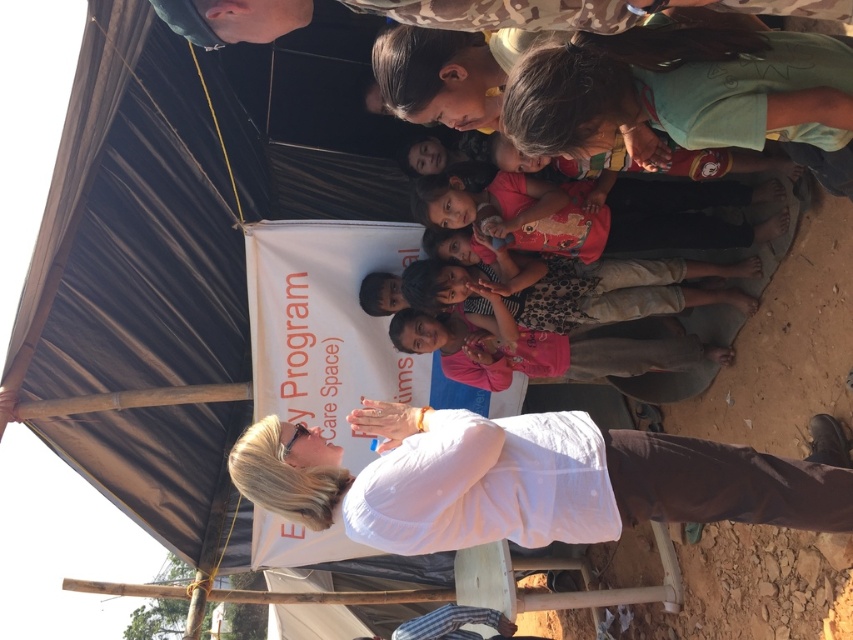
Does matte pink shirt at center appear on the left side of light brown skin at center?

Incorrect, matte pink shirt at center is not on the left side of light brown skin at center.

Which of these two, matte pink shirt at center or light brown skin at center, stands taller?

Standing taller between the two is matte pink shirt at center.

The image size is (853, 640). Describe the element at coordinates (645, 218) in the screenshot. I see `matte pink shirt at center` at that location.

At what (x,y) coordinates should I click in order to perform the action: click on matte pink shirt at center. Please return your answer as a coordinate pair (x, y). Looking at the image, I should click on (645, 218).

This screenshot has height=640, width=853. I want to click on matte pink shirt at center, so tap(645, 218).

Between point (477, 195) and point (425, 17), which one is positioned in front?

Point (425, 17)

Locate an element on the screen. The image size is (853, 640). matte pink shirt at center is located at coordinates (645, 218).

Can you confirm if light brown cotton pants at center is wider than camouflage fabric at upper center?

Yes, light brown cotton pants at center is wider than camouflage fabric at upper center.

Can you confirm if light brown cotton pants at center is taller than camouflage fabric at upper center?

Yes, light brown cotton pants at center is taller than camouflage fabric at upper center.

Locate an element on the screen. This screenshot has height=640, width=853. light brown cotton pants at center is located at coordinates (573, 289).

You are a GUI agent. You are given a task and a screenshot of the screen. Output one action in this format:
    pyautogui.click(x=<x>, y=<y>)
    Task: Click on the light brown cotton pants at center
    Image resolution: width=853 pixels, height=640 pixels.
    Given the screenshot: What is the action you would take?
    pyautogui.click(x=573, y=289)